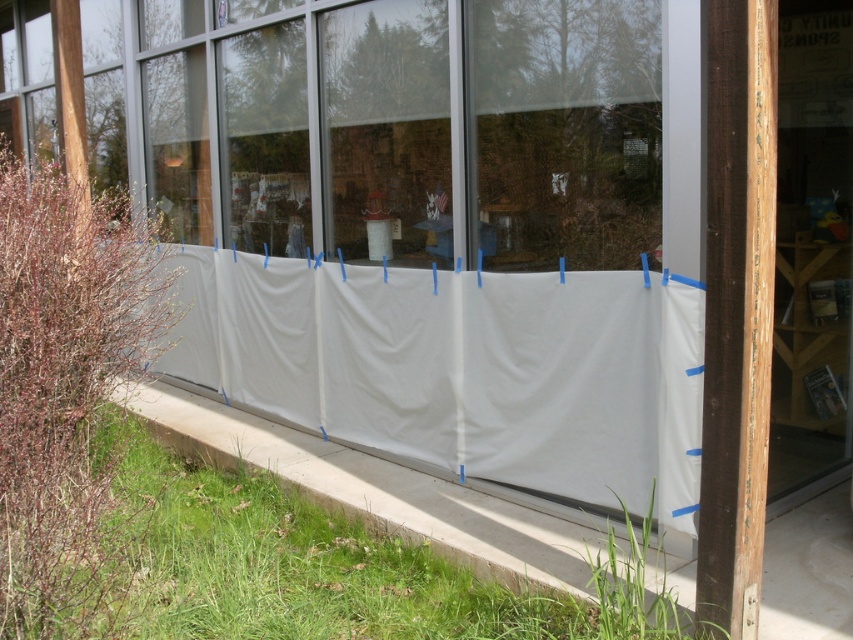
You are standing in front of the building and want to take a photo of the window. The transparent plastic sheet at center and the white fabric screen door at right are blocking your view. Which object should you move first to get a clearer shot?

You should move the transparent plastic sheet at center first because it is closer to the viewer than the white fabric screen door at right, so removing it would clear the immediate obstruction.